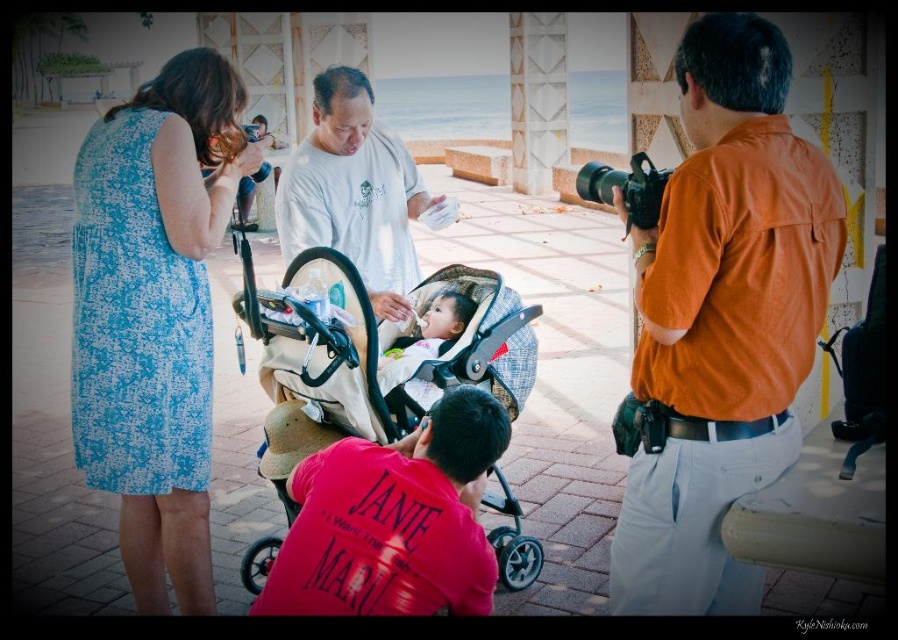
Question: Which is farther from the blue printed dress at left?

Choices:
 (A) soft white baby at center
 (B) black plastic camera at right

Answer: (B)

Question: Which of these objects is positioned farthest from the black plastic camera at right?

Choices:
 (A) blue printed dress at left
 (B) soft white baby at center
 (C) plastic baby carriage at center

Answer: (A)

Question: Does blue printed dress at left have a lesser width compared to plastic baby carriage at center?

Choices:
 (A) yes
 (B) no

Answer: (A)

Question: Can you confirm if pink cotton shirt at center is smaller than white cotton shirt at center?

Choices:
 (A) yes
 (B) no

Answer: (A)

Question: Among these objects, which one is nearest to the camera?

Choices:
 (A) plastic baby carriage at center
 (B) soft white baby at center
 (C) pink cotton shirt at center

Answer: (C)

Question: Is blue printed dress at left wider than black plastic camera at right?

Choices:
 (A) yes
 (B) no

Answer: (B)